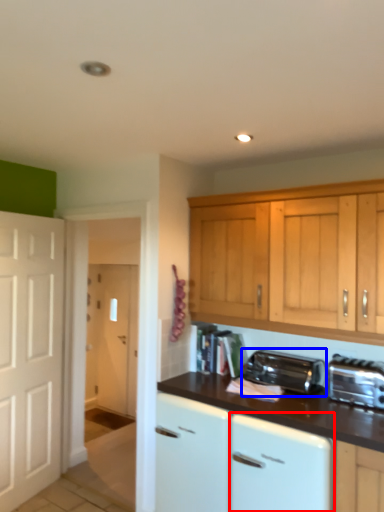
Question: Which point is further to the camera, dish washer (highlighted by a red box) or kitchen appliance (highlighted by a blue box)?

Choices:
 (A) dish washer
 (B) kitchen appliance

Answer: (B)